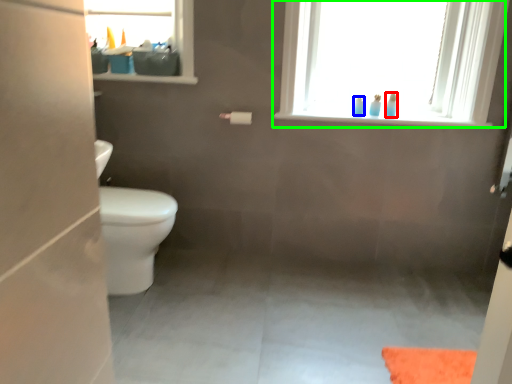
Question: Based on their relative distances, which object is nearer to toiletry (highlighted by a red box)? Choose from toiletry (highlighted by a blue box) and window (highlighted by a green box).

Choices:
 (A) toiletry
 (B) window

Answer: (A)